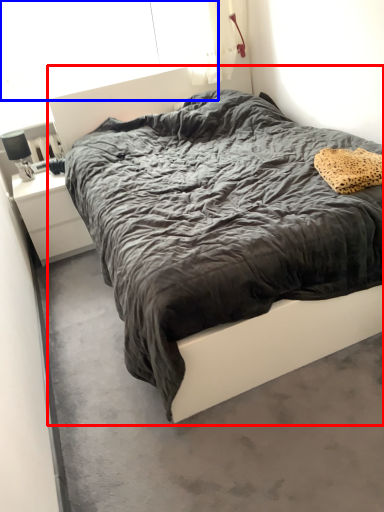
Question: Which object is closer to the camera taking this photo, bed (highlighted by a red box) or window screen (highlighted by a blue box)?

Choices:
 (A) bed
 (B) window screen

Answer: (A)